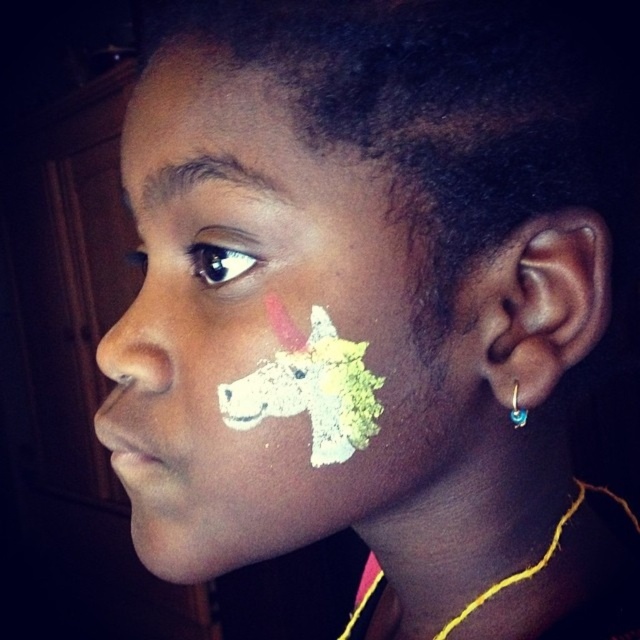
Question: Can you confirm if matte skin at upper left is thinner than blue gemstone hoop at ear?

Choices:
 (A) no
 (B) yes

Answer: (A)

Question: Which object appears closest to the camera in this image?

Choices:
 (A) white matte unicorn at center
 (B) blue gemstone hoop at ear

Answer: (A)

Question: Which point is closer to the camera taking this photo?

Choices:
 (A) (232, 253)
 (B) (280, 104)
 (C) (140, 376)

Answer: (B)

Question: Which is nearer to the blue gemstone hoop at ear?

Choices:
 (A) matte skin at upper left
 (B) white matte unicorn at center

Answer: (B)

Question: Can you confirm if white matte unicorn at center is positioned to the right of matte white nose at left?

Choices:
 (A) yes
 (B) no

Answer: (A)

Question: Does white matte unicorn at center have a smaller size compared to matte white nose at left?

Choices:
 (A) yes
 (B) no

Answer: (B)